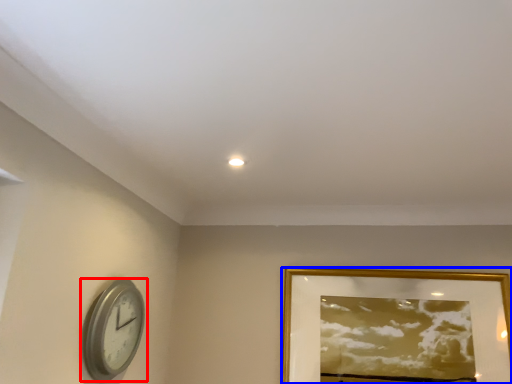
Question: Which object appears closest to the camera in this image, wall clock (highlighted by a red box) or picture frame (highlighted by a blue box)?

Choices:
 (A) wall clock
 (B) picture frame

Answer: (A)